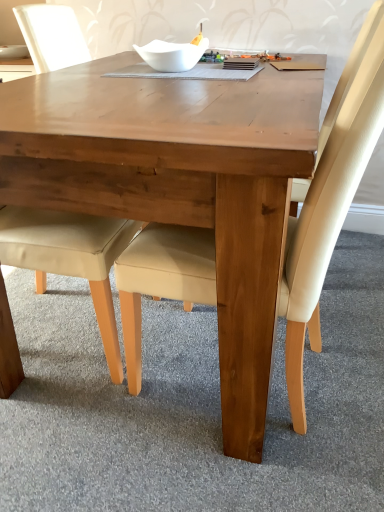
Question: From a real-world perspective, is white glossy bowl at upper center positioned above or below beige leather chair at lower left, which is the 2th chair from right to left?

Choices:
 (A) above
 (B) below

Answer: (A)

Question: From their relative heights in the image, would you say white glossy bowl at upper center is taller or shorter than beige leather chair at lower left, which is the 2th chair from right to left?

Choices:
 (A) tall
 (B) short

Answer: (B)

Question: Estimate the real-world distances between objects in this image. Which object is closer to the white glossy bowl at upper center?

Choices:
 (A) wooden table at center
 (B) beige leather chair at lower left, the first chair positioned from the left
 (C) beige leather chair at center, which is counted as the 1th chair, starting from the right
 (D) white glossy bowl at upper center

Answer: (D)

Question: Which object is positioned closest to the white glossy bowl at upper center?

Choices:
 (A) beige leather chair at center, which is counted as the 1th chair, starting from the right
 (B) wooden table at center
 (C) beige leather chair at lower left, which is the 2th chair from right to left
 (D) white glossy bowl at upper center

Answer: (D)